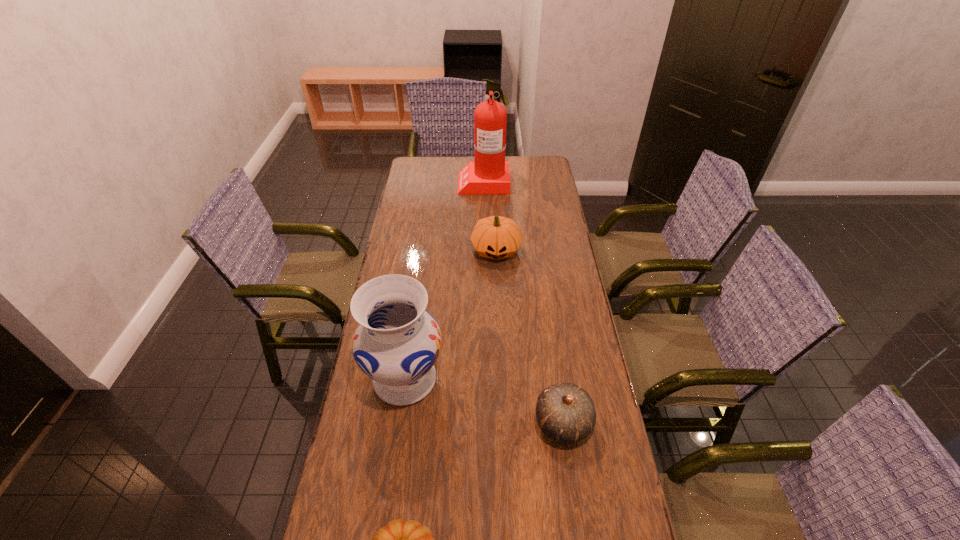
Locate an element on the screen. free space between the third shortest object and the fire extinguisher is located at coordinates click(x=490, y=215).

Find the location of a particular element. The width and height of the screenshot is (960, 540). vacant space that is in between the fourth shortest object and the second farthest object is located at coordinates (450, 315).

The width and height of the screenshot is (960, 540). I want to click on vacant space in between the vase and the fourth nearest object, so click(x=450, y=315).

Where is `unoccupied area between the fourth nearest object and the vase`? unoccupied area between the fourth nearest object and the vase is located at coordinates (450, 315).

Where is `object that ranks as the closest to the farthest object`? Image resolution: width=960 pixels, height=540 pixels. object that ranks as the closest to the farthest object is located at coordinates (496, 237).

Where is `object that stands as the closest to the second tallest object`? The width and height of the screenshot is (960, 540). object that stands as the closest to the second tallest object is located at coordinates (566, 413).

Where is `gourd that is the closest to the leftmost gourd`? The image size is (960, 540). gourd that is the closest to the leftmost gourd is located at coordinates (566, 413).

Locate an element on the screen. The width and height of the screenshot is (960, 540). gourd that is the second nearest to the second farthest gourd is located at coordinates (496, 237).

The width and height of the screenshot is (960, 540). I want to click on free spot that satisfies the following two spatial constraints: 1. on the front-facing side of the tallest object; 2. on the front side of the second tallest object, so click(x=486, y=379).